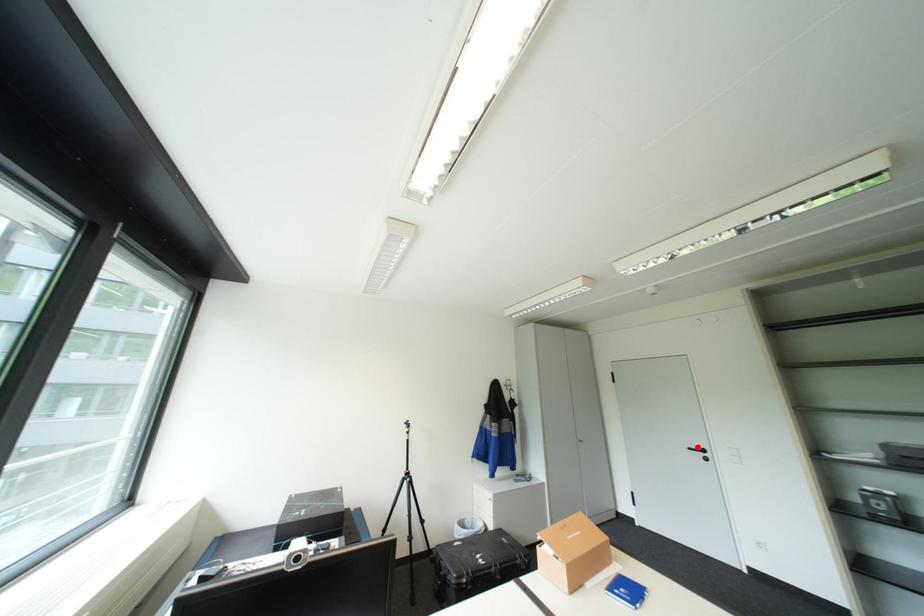
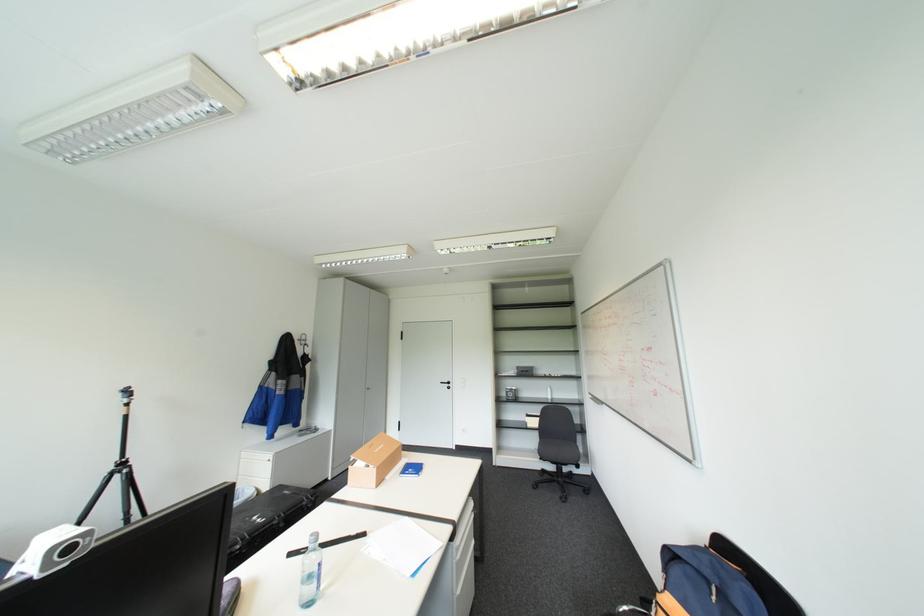
In the second image, find the point that corresponds to the highlighted location in the first image.

(450, 381)